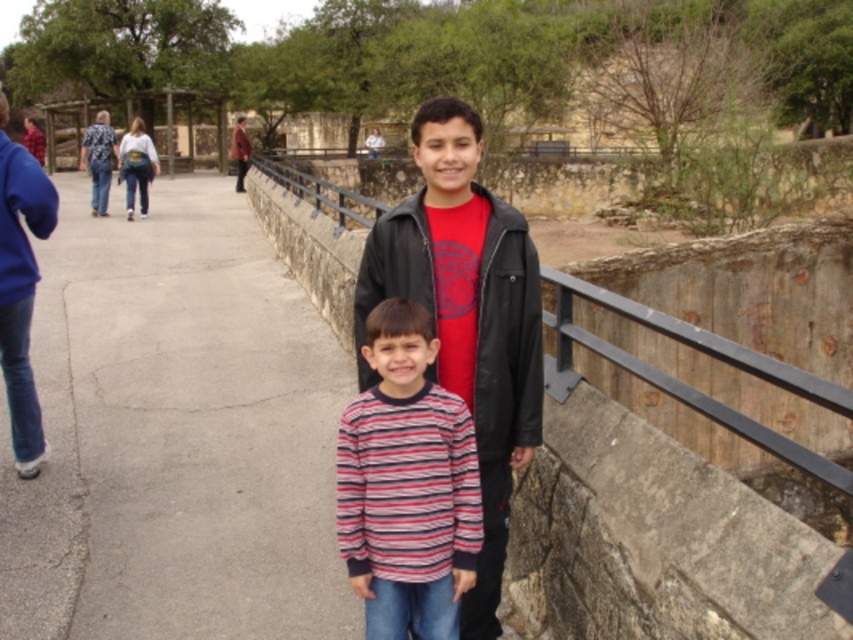
You are a photographer trying to capture the black leather jacket at center in your shot. Based on the scene description, where exactly should you focus your camera to ensure the jacket is centered in the frame?

You should focus your camera at point coordinates of (508, 337) to center the black leather jacket at center in the frame.

You are a photographer trying to capture the black leather jacket at center in your shot. Based on the coordinates provided, where should you position your camera to ensure the jacket is centered in the frame?

To center the black leather jacket at center in your frame, position your camera at the coordinates provided, which are point (508, 337).

You are a photographer setting up a photo shoot in the park. You have two subjects wearing the black leather jacket at center and the red plaid shirt at center. You need to arrange them so that both are fully visible in the frame. Which subject should you position closer to the camera to ensure their full height is captured without cropping?

You should position the black leather jacket at center closer to the camera because it is shorter than the red plaid shirt at center, allowing both to be fully visible in the frame.